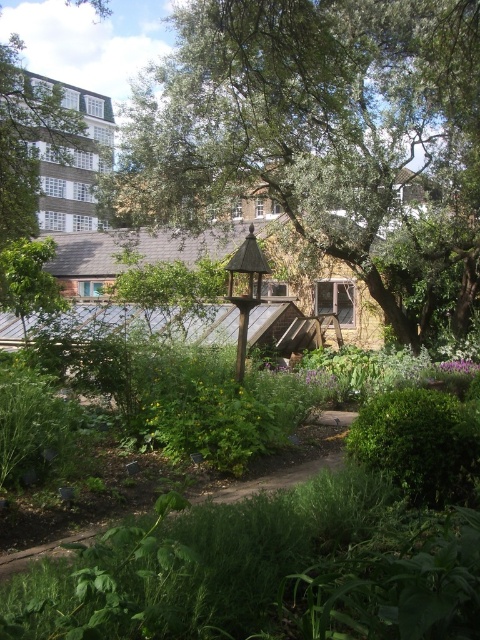
You are standing at the entrance of the garden and want to reach the birdhouse in the center. The garden has a brown dirt path at center. Based on the coordinates given, is the path directly in front of you or to your side?

The brown dirt path at center is located at coordinates (288, 465), which places it to your side rather than directly in front, so you should adjust your direction to align with the path to reach the birdhouse.

You are a gardener who wants to place a new flower pot between the brown dirt path at center and the wooden gazebo at center. According to the scene, where exactly should you place the flower pot?

The flower pot should be placed between the brown dirt path at center and the wooden gazebo at center, as the brown dirt path at center is located below the wooden gazebo at center.